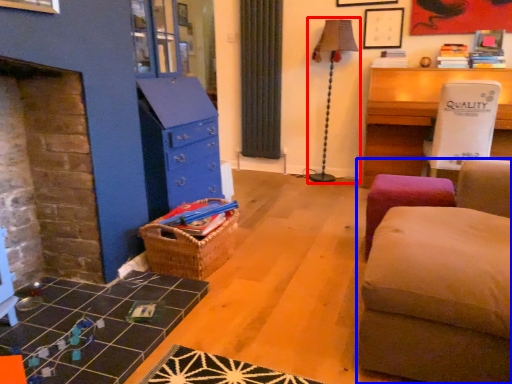
Question: Which object appears farthest to the camera in this image, table lamp (highlighted by a red box) or studio couch (highlighted by a blue box)?

Choices:
 (A) table lamp
 (B) studio couch

Answer: (A)